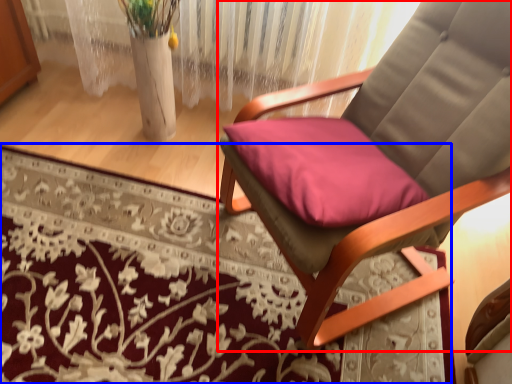
Question: Which point is closer to the camera, chair (highlighted by a red box) or mat (highlighted by a blue box)?

Choices:
 (A) chair
 (B) mat

Answer: (A)